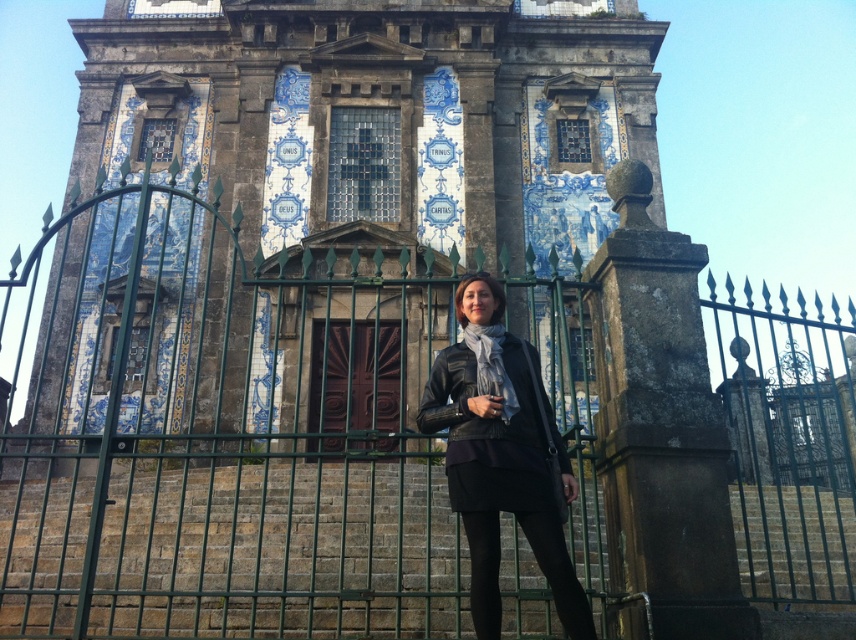
Question: Does blue glazed tiles at center appear on the right side of black leather jacket at center?

Choices:
 (A) no
 (B) yes

Answer: (A)

Question: Can you confirm if blue glazed tiles at center is positioned to the right of black leather jacket at center?

Choices:
 (A) no
 (B) yes

Answer: (A)

Question: Among these objects, which one is nearest to the camera?

Choices:
 (A) blue glazed tiles at center
 (B) black leather jacket at center

Answer: (B)

Question: Which point is closer to the camera?

Choices:
 (A) (547, 524)
 (B) (182, 129)

Answer: (A)

Question: Does blue glazed tiles at center have a greater width compared to black leather jacket at center?

Choices:
 (A) no
 (B) yes

Answer: (B)